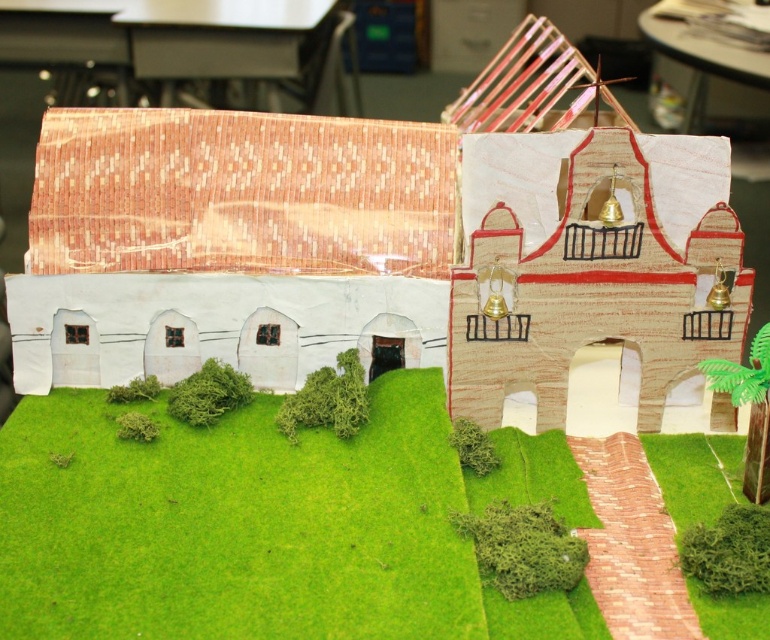
In the scene shown: You are a small toy car trying to drive from the green artificial turf at lower center to the cardboard model building at center. Can you reach the building from the turf without any obstacles?

The green artificial turf at lower center is located below the cardboard model building at center, so the toy car can drive up to the building since the turf is directly beneath it.

You are a toy delivery person who needs to place a 3.5 inch wide package between the green artificial turf at lower center and the cardboard model building at center. Can the package fit in the space between them?

The green artificial turf at lower center is 7.03 inches away from the cardboard model building at center. Since the package is 3.5 inches wide, which is less than the 7.03 inches of space available, the package can fit between them.

You are designing a garden layout and need to place a small statue that requires a 10 cm wide base. You have the green artificial turf at lower center and the cardboard model building at center in your design. Which area can accommodate the statue?

The green artificial turf at lower center is thinner than the cardboard model building at center, so the statue with a 10 cm wide base can be placed on the cardboard model building at center since it has more width available.